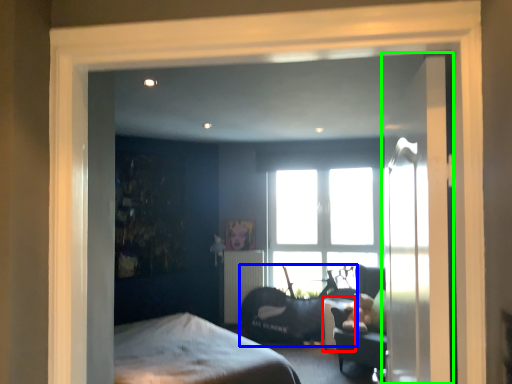
Question: Which object is positioned closest to table (highlighted by a red box)? Select from swivel chair (highlighted by a blue box) and door (highlighted by a green box).

Choices:
 (A) swivel chair
 (B) door

Answer: (A)